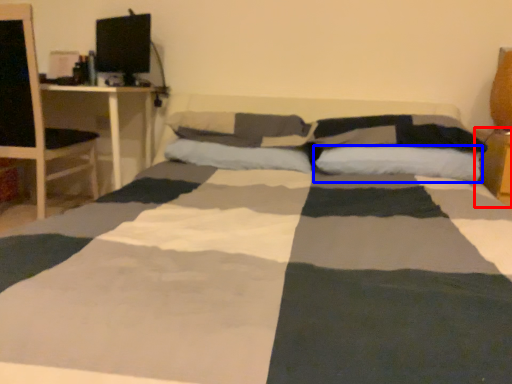
Question: Which point is closer to the camera, table (highlighted by a red box) or pillow (highlighted by a blue box)?

Choices:
 (A) table
 (B) pillow

Answer: (B)